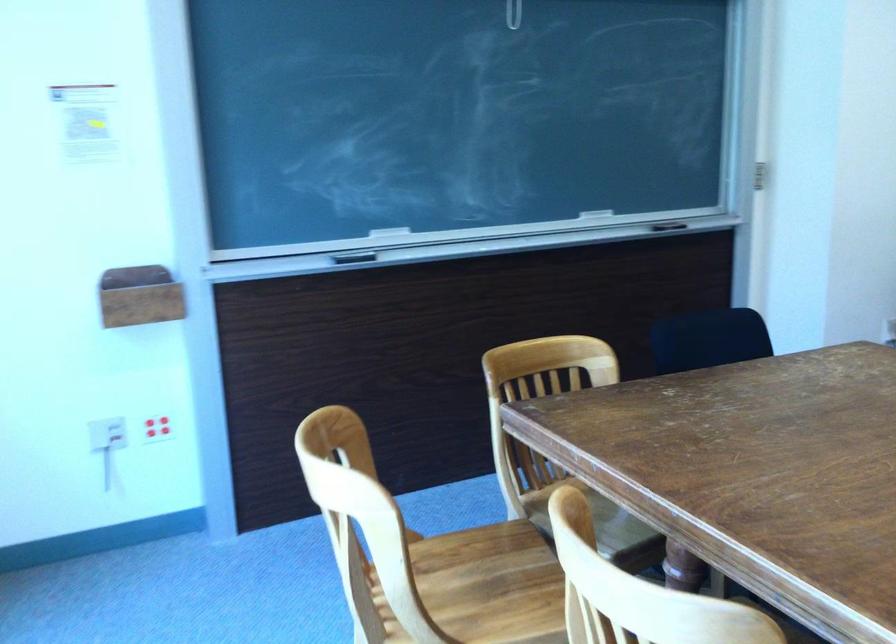
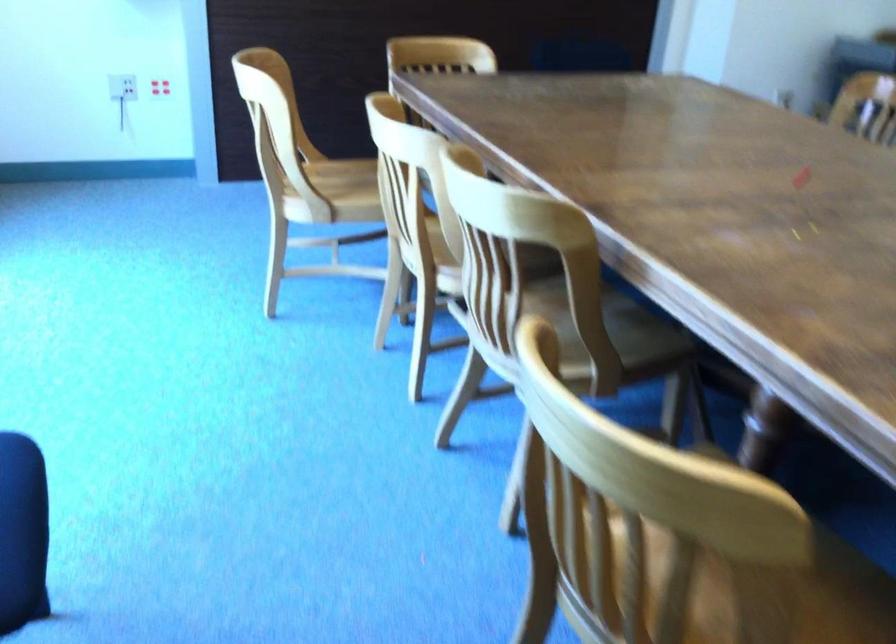
The point at (156,433) is marked in the first image. Where is the corresponding point in the second image?

(159, 87)